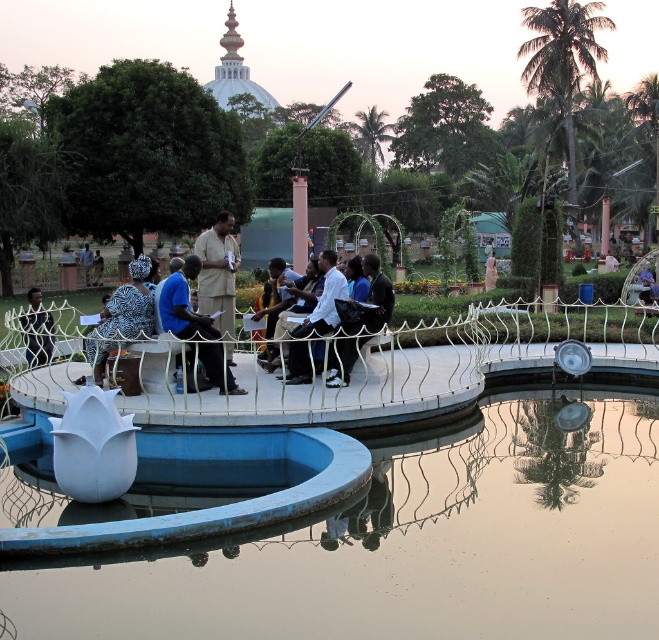
You are attending an outdoor event at the park and notice two items at the center of the scene. Which item is wider between the white fabric dress at center and the zebra print scarf at center?

The white fabric dress at center is wider than the zebra print scarf at center.

You are standing in the park and want to place a small decorative item between the two points, point (111, 330) and point (28, 346). Which point should the item be closer to in order to be nearer to the viewer?

The item should be placed closer to point (111, 330) because it is closer to the viewer than point (28, 346).

You are standing at the edge of the circular water feature in the park. You see a zebra print scarf at center. If you walk directly towards the center of the water feature, will you step on the scarf?

The zebra print scarf at center is located at point (123, 317), which is near the center of the water feature. Walking directly towards the center would lead you to step on the scarf.